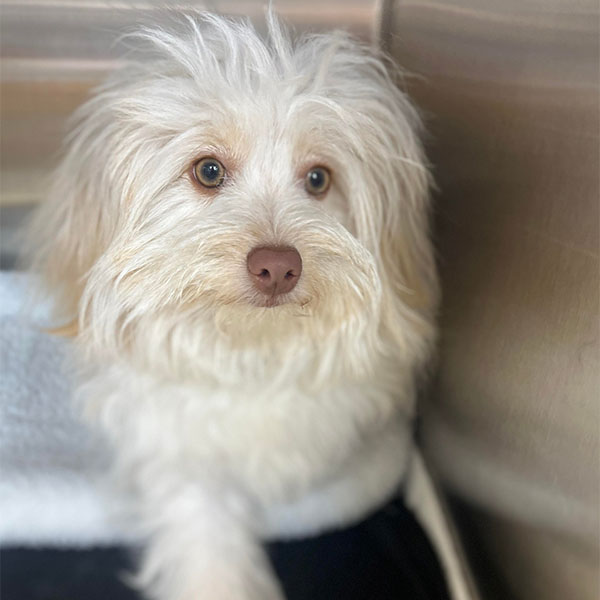
Find the location of a particular element. The height and width of the screenshot is (600, 600). dog bed is located at coordinates (45, 447).